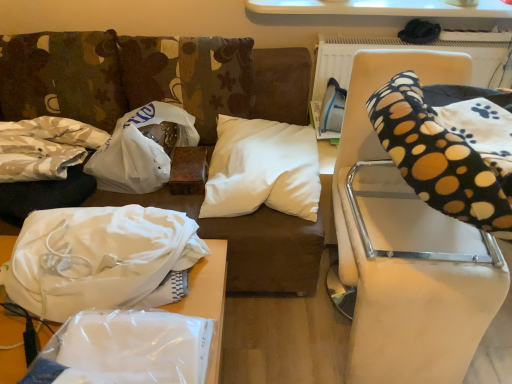
What is the approximate height of white plastic bag at center, the 3th material from the left?

white plastic bag at center, the 3th material from the left, is 24.55 centimeters tall.

In order to click on white plastic bag at center, the 3th material from the left in this screenshot , I will do `click(142, 149)`.

Locate an element on the screen. This screenshot has height=384, width=512. transparent plastic bag at lower left, acting as the second furniture starting from the right is located at coordinates (207, 299).

The width and height of the screenshot is (512, 384). Describe the element at coordinates (45, 147) in the screenshot. I see `white fabric at left, which ranks as the 3th material in right-to-left order` at that location.

You are a GUI agent. You are given a task and a screenshot of the screen. Output one action in this format:
    pyautogui.click(x=<x>, y=<y>)
    Task: Click on the white fabric at left, the 1th material in the left-to-right sequence
    The height and width of the screenshot is (384, 512).
    Given the screenshot: What is the action you would take?
    [x=45, y=147]

Identify the location of black polka dot bean bag chair at right. Image resolution: width=512 pixels, height=384 pixels. (436, 157).

The image size is (512, 384). I want to click on white plastic bag at center, the 1th material viewed from the right, so click(x=142, y=149).

Considering the relative positions of transparent plastic bag at lower left, arranged as the first furniture when viewed from the left, and white fabric at lower left, arranged as the 2th material when viewed from the right, in the image provided, is transparent plastic bag at lower left, arranged as the first furniture when viewed from the left, to the right of white fabric at lower left, arranged as the 2th material when viewed from the right, from the viewer's perspective?

Indeed, transparent plastic bag at lower left, arranged as the first furniture when viewed from the left, is positioned on the right side of white fabric at lower left, arranged as the 2th material when viewed from the right.

Would you say transparent plastic bag at lower left, arranged as the first furniture when viewed from the left, is a long distance from white fabric at lower left, which appears as the 2th material when viewed from the left?

No, transparent plastic bag at lower left, arranged as the first furniture when viewed from the left, is in close proximity to white fabric at lower left, which appears as the 2th material when viewed from the left.

Can you confirm if transparent plastic bag at lower left, arranged as the first furniture when viewed from the left, is wider than white fabric at lower left, which appears as the 2th material when viewed from the left?

No.

From the picture: Do you think white fabric at left, which ranks as the 3th material in right-to-left order, is within white soft pillow at center, or outside of it?

white fabric at left, which ranks as the 3th material in right-to-left order, lies outside white soft pillow at center.

Is white fabric at left, the 1th material in the left-to-right sequence, wider or thinner than white soft pillow at center?

In the image, white fabric at left, the 1th material in the left-to-right sequence, appears to be more narrow than white soft pillow at center.

Does white fabric at left, the 1th material in the left-to-right sequence, appear on the right side of white soft pillow at center?

No.

Is the surface of white soft pillow at center in direct contact with black polka dot bean bag chair at right?

No, white soft pillow at center is not making contact with black polka dot bean bag chair at right.

From the image's perspective, is white soft pillow at center on black polka dot bean bag chair at right?

No, from the image's perspective, white soft pillow at center is not over black polka dot bean bag chair at right.

Measure the distance between white soft pillow at center and black polka dot bean bag chair at right.

white soft pillow at center is 61.32 centimeters away from black polka dot bean bag chair at right.

Consider the image. In terms of width, does white soft pillow at center look wider or thinner when compared to black polka dot bean bag chair at right?

In the image, white soft pillow at center appears to be more narrow than black polka dot bean bag chair at right.

Which of these two, white fabric at lower left, arranged as the 2th material when viewed from the right, or transparent plastic bag at lower left, arranged as the first furniture when viewed from the left, stands shorter?

With less height is transparent plastic bag at lower left, arranged as the first furniture when viewed from the left.

Would you consider white fabric at lower left, which appears as the 2th material when viewed from the left, to be distant from transparent plastic bag at lower left, arranged as the first furniture when viewed from the left?

white fabric at lower left, which appears as the 2th material when viewed from the left, is actually quite close to transparent plastic bag at lower left, arranged as the first furniture when viewed from the left.

How much distance is there between white fabric at lower left, which appears as the 2th material when viewed from the left, and transparent plastic bag at lower left, arranged as the first furniture when viewed from the left?

white fabric at lower left, which appears as the 2th material when viewed from the left, is 9.33 inches from transparent plastic bag at lower left, arranged as the first furniture when viewed from the left.

Which is nearer, (42,254) or (198,279)?

Point (42,254) appears to be closer to the viewer than point (198,279).

How different are the orientations of white plastic bag at center, the 1th material viewed from the right, and transparent plastic bag at lower left, arranged as the first furniture when viewed from the left, in degrees?

They differ by 2.64 degrees in their facing directions.

Who is bigger, white plastic bag at center, the 1th material viewed from the right, or transparent plastic bag at lower left, arranged as the first furniture when viewed from the left?

Bigger between the two is white plastic bag at center, the 1th material viewed from the right.

Considering the relative sizes of white plastic bag at center, the 1th material viewed from the right, and transparent plastic bag at lower left, arranged as the first furniture when viewed from the left, in the image provided, is white plastic bag at center, the 1th material viewed from the right, wider than transparent plastic bag at lower left, arranged as the first furniture when viewed from the left,?

Yes, white plastic bag at center, the 1th material viewed from the right, is wider than transparent plastic bag at lower left, arranged as the first furniture when viewed from the left.

Based on the photo, is white plastic bag at center, the 1th material viewed from the right, positioned with its back to transparent plastic bag at lower left, arranged as the first furniture when viewed from the left?

No, white plastic bag at center, the 1th material viewed from the right, is not facing away from transparent plastic bag at lower left, arranged as the first furniture when viewed from the left.

In the scene shown: Between white plastic bag at center, the 1th material viewed from the right, and white soft pillow at center, which one appears on the left side from the viewer's perspective?

white plastic bag at center, the 1th material viewed from the right.

Is white plastic bag at center, the 3th material from the left, bigger than white soft pillow at center?

Actually, white plastic bag at center, the 3th material from the left, might be smaller than white soft pillow at center.

Is the depth of white plastic bag at center, the 1th material viewed from the right, greater than that of white soft pillow at center?

Yes, white plastic bag at center, the 1th material viewed from the right, is behind white soft pillow at center.

Is white plastic bag at center, the 3th material from the left, facing towards white soft pillow at center?

No, white plastic bag at center, the 3th material from the left, is not facing towards white soft pillow at center.

How different are the orientations of black polka dot bean bag chair at right and white soft pillow at center in degrees?

The angle between the facing direction of black polka dot bean bag chair at right and the facing direction of white soft pillow at center is 0.342 degrees.

Considering the sizes of black polka dot bean bag chair at right and white soft pillow at center in the image, is black polka dot bean bag chair at right wider or thinner than white soft pillow at center?

Considering their sizes, black polka dot bean bag chair at right looks broader than white soft pillow at center.

Is black polka dot bean bag chair at right turned away from white soft pillow at center?

No, black polka dot bean bag chair at right's orientation is not away from white soft pillow at center.

Considering the sizes of black polka dot bean bag chair at right and white soft pillow at center in the image, is black polka dot bean bag chair at right taller or shorter than white soft pillow at center?

Considering their sizes, black polka dot bean bag chair at right has more height than white soft pillow at center.

This screenshot has height=384, width=512. Identify the location of furniture below the white fabric at lower left, which appears as the 2th material when viewed from the left (from the image's perspective). (207, 299).

The width and height of the screenshot is (512, 384). Identify the location of pillow to the right of white fabric at left, the 1th material in the left-to-right sequence. tap(262, 169).

Based on the photo, estimate the real-world distances between objects in this image. Which object is further from transparent plastic bag at lower left, arranged as the first furniture when viewed from the left, black polka dot bean bag chair at right or white fabric at left, the 1th material in the left-to-right sequence?

black polka dot bean bag chair at right lies further to transparent plastic bag at lower left, arranged as the first furniture when viewed from the left, than the other object.

From the picture: Considering their positions, is transparent plastic bag at lower left, acting as the second furniture starting from the right, positioned further to black polka dot fabric at right, which appears as the 2th furniture when viewed from the left, than black polka dot bean bag chair at right?

Among the two, transparent plastic bag at lower left, acting as the second furniture starting from the right, is located further to black polka dot fabric at right, which appears as the 2th furniture when viewed from the left.

When comparing their distances from white plastic bag at center, the 3th material from the left, does transparent plastic bag at lower left, acting as the second furniture starting from the right, or black polka dot fabric at right, which appears as the 2th furniture when viewed from the left, seem closer?

transparent plastic bag at lower left, acting as the second furniture starting from the right.

Which object lies nearer to the anchor point black polka dot bean bag chair at right, transparent plastic bag at lower left, arranged as the first furniture when viewed from the left, or white fabric at left, the 1th material in the left-to-right sequence?

transparent plastic bag at lower left, arranged as the first furniture when viewed from the left.

Considering their positions, is black polka dot bean bag chair at right positioned closer to white fabric at left, which ranks as the 3th material in right-to-left order, than white soft pillow at center?

The object closer to white fabric at left, which ranks as the 3th material in right-to-left order, is white soft pillow at center.

Estimate the real-world distances between objects in this image. Which object is closer to transparent plastic bag at lower left, acting as the second furniture starting from the right, white soft pillow at center or white plastic bag at center, the 3th material from the left?

white soft pillow at center.

Which object lies further to the anchor point black polka dot fabric at right, which appears as the 2th furniture when viewed from the left, white plastic bag at center, the 1th material viewed from the right, or white soft pillow at center?

Among the two, white plastic bag at center, the 1th material viewed from the right, is located further to black polka dot fabric at right, which appears as the 2th furniture when viewed from the left.

Looking at the image, which one is located further to white fabric at left, the 1th material in the left-to-right sequence, white fabric at lower left, which appears as the 2th material when viewed from the left, or black polka dot fabric at right, arranged as the first furniture when viewed from the right?

Among the two, black polka dot fabric at right, arranged as the first furniture when viewed from the right, is located further to white fabric at left, the 1th material in the left-to-right sequence.

The height and width of the screenshot is (384, 512). I want to click on furniture between white fabric at lower left, arranged as the 2th material when viewed from the right, and black polka dot fabric at right, which appears as the 2th furniture when viewed from the left, from left to right, so click(x=207, y=299).

Locate an element on the screen. furniture situated between white fabric at left, which ranks as the 3th material in right-to-left order, and black polka dot fabric at right, which appears as the 2th furniture when viewed from the left, from left to right is located at coordinates (207, 299).

The width and height of the screenshot is (512, 384). Find the location of `material located between white fabric at lower left, which appears as the 2th material when viewed from the left, and white soft pillow at center in the left-right direction`. material located between white fabric at lower left, which appears as the 2th material when viewed from the left, and white soft pillow at center in the left-right direction is located at coordinates (142, 149).

The height and width of the screenshot is (384, 512). Identify the location of furniture situated between white plastic bag at center, the 3th material from the left, and black polka dot fabric at right, which appears as the 2th furniture when viewed from the left, from left to right. (207, 299).